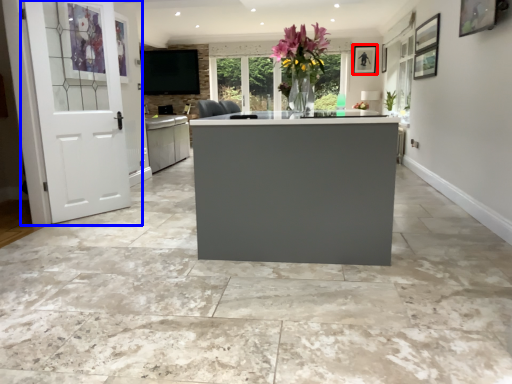
Question: Which of the following is the closest to the observer, picture frame (highlighted by a red box) or door (highlighted by a blue box)?

Choices:
 (A) picture frame
 (B) door

Answer: (B)